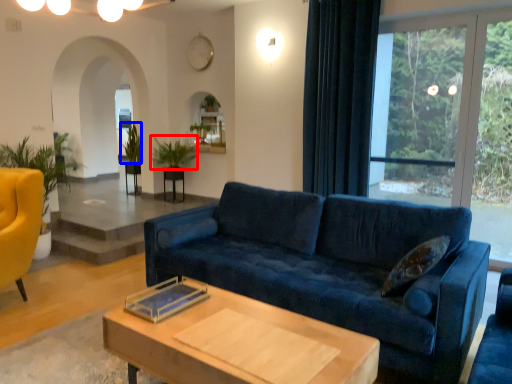
Question: Which point is further to the camera, plant (highlighted by a red box) or plant (highlighted by a blue box)?

Choices:
 (A) plant
 (B) plant

Answer: (B)